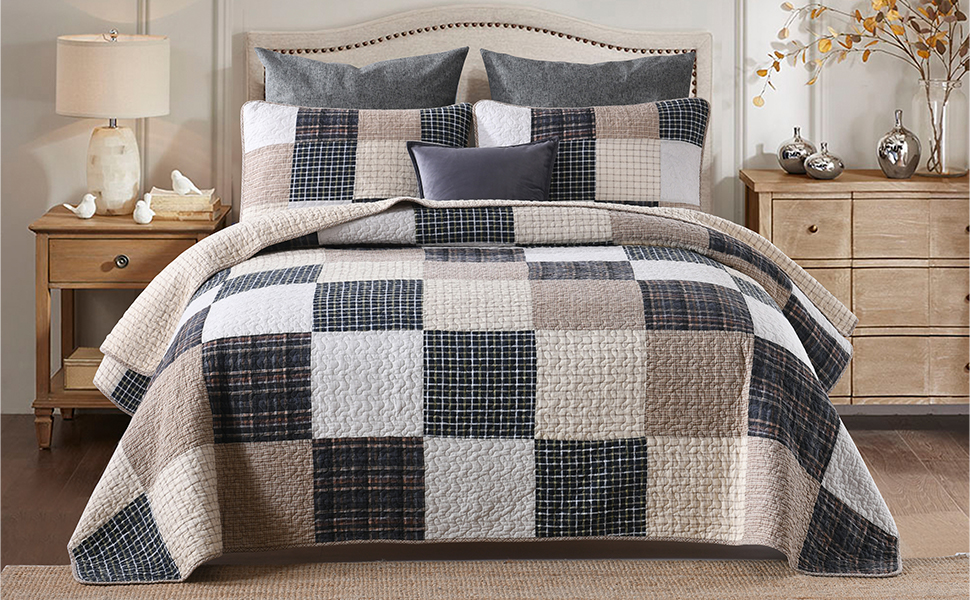
This screenshot has height=600, width=970. Identify the location of pillow. (651, 142), (315, 164), (510, 172), (326, 81), (588, 76).